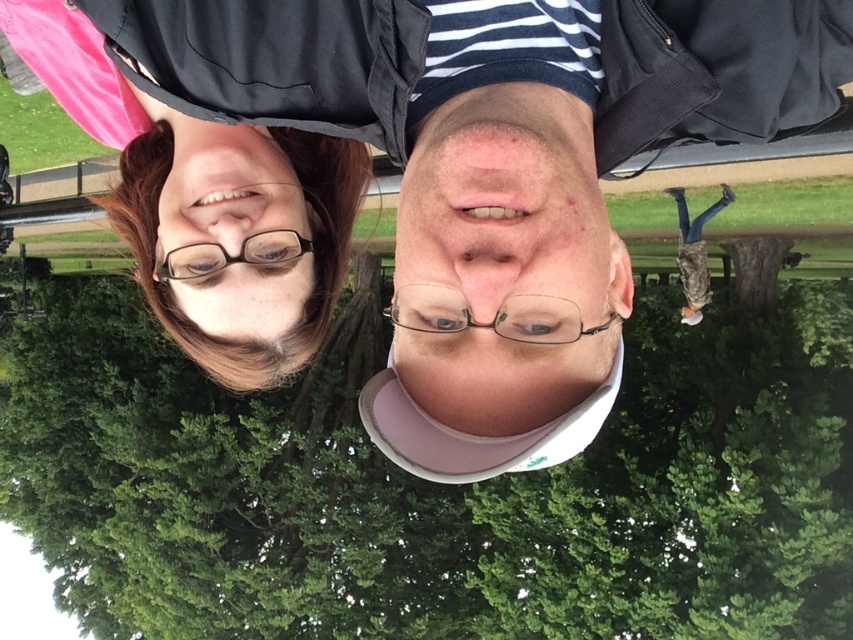
Looking at the rotated image, where the top is now on the left side, can you tell me which of the two glasses, the matte black glasses at upper left or the clear plastic glasses at upper center, is positioned more to the left side of the image?

The matte black glasses at upper left is positioned more to the left side of the image because it is to the left of the clear plastic glasses at upper center.

You are a photographer trying to capture a closeup of the matte black glasses at upper left and the clear plastic glasses at upper center in the rotated image. Since the image is rotated, you need to adjust your camera. Which glasses should you zoom in on first to ensure they are in focus, considering their size?

The matte black glasses at upper left is larger in size than the clear plastic glasses at upper center, so you should zoom in on the matte black glasses at upper left first to ensure they are in focus because their larger size may require more precise adjustment.